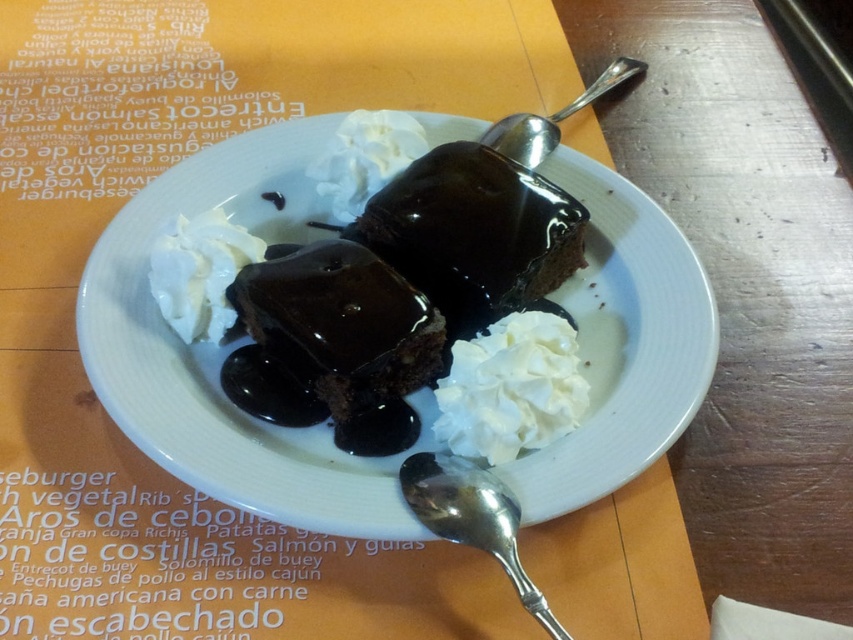
You are a dessert lover who wants to know which item is bigger between the white creamy whipped cream at center and the silver metallic spoon at lower center. Can you tell me?

The white creamy whipped cream at center is smaller than the silver metallic spoon at lower center, so the spoon is bigger.

You are a photographer trying to capture the dessert from above. You notice two points marked on the plate at coordinates point [352,337] and point [546,147]. Which point will appear closer to the edge of the photo frame?

Point [546,147] is further from the camera than point [352,337]. Since the photo frame edge corresponds to the furthest points from the camera, point [546,147] will be closer to the edge of the photo frame.

You are a customer at a restaurant and see this dessert plate. You want to pick up the silver metallic spoon at lower center to eat the white creamy whipped cream at center. Can you reach the whipped cream by moving the spoon towards it?

The white creamy whipped cream at center is positioned on the right side of the silver metallic spoon at lower center, so moving the spoon towards the whipped cream would allow you to reach it.